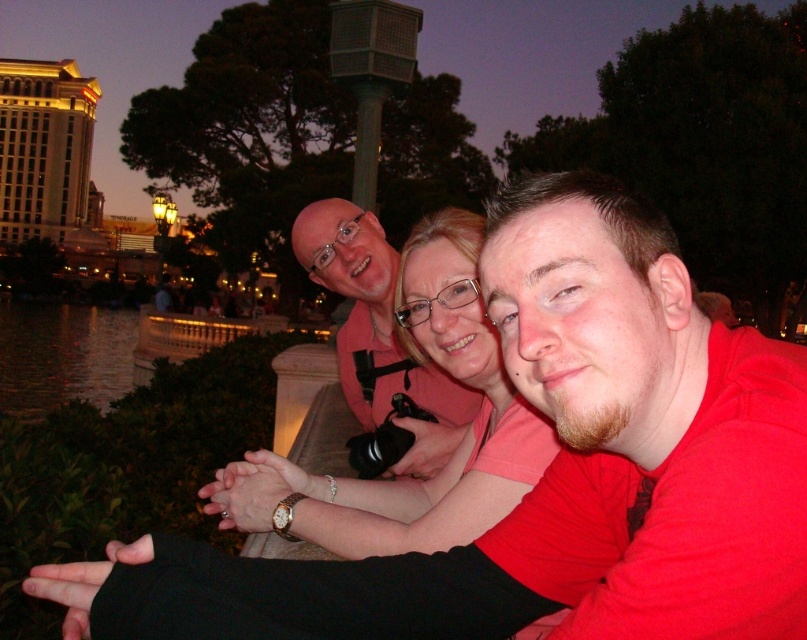
Is pink fabric at center above matte pink shirt at center?

No, pink fabric at center is not above matte pink shirt at center.

In the scene shown: Between pink fabric at center and matte pink shirt at center, which one appears on the left side from the viewer's perspective?

Positioned to the left is matte pink shirt at center.

Is point (508, 458) positioned behind point (375, 237)?

No.

Locate an element on the screen. This screenshot has width=807, height=640. pink fabric at center is located at coordinates (454, 449).

Which is above, matte pink shirt at center or dark reflective water at lower left?

dark reflective water at lower left

Is point (358, 381) behind point (101, 392)?

No, it is not.

At what (x,y) coordinates should I click in order to perform the action: click on matte pink shirt at center. Please return your answer as a coordinate pair (x, y). Looking at the image, I should click on (378, 332).

Looking at this image, does pink fabric at center have a lesser height compared to dark reflective water at lower left?

In fact, pink fabric at center may be taller than dark reflective water at lower left.

Is point (496, 392) positioned in front of point (9, 301)?

Yes.

Is point (479, 340) behind point (78, 346)?

No, (479, 340) is closer to viewer.

Identify the location of pink fabric at center. This screenshot has width=807, height=640. (454, 449).